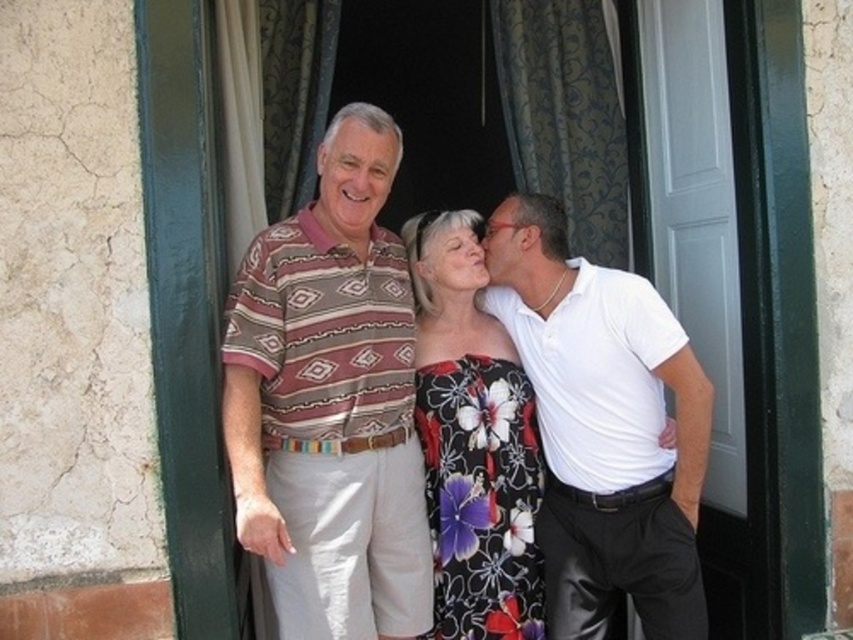
Is floral dress at center taller than blue patterned curtain at upper center?

Indeed, floral dress at center has a greater height compared to blue patterned curtain at upper center.

Who is more distant from viewer, (x=463, y=429) or (x=613, y=212)?

Point (x=613, y=212)

Identify the location of floral dress at center. (473, 440).

Is striped cotton shirt at center taller than white glossy shirt at right?

In fact, striped cotton shirt at center may be shorter than white glossy shirt at right.

Is point (347, 436) positioned in front of point (546, 372)?

Yes, it is.

Is point (227, 317) positioned after point (541, 195)?

No.

Identify the location of striped cotton shirt at center. (323, 436).

Does brown striped polo shirt at center appear on the right side of floral dress at center?

Incorrect, brown striped polo shirt at center is not on the right side of floral dress at center.

Does point (289, 330) lie behind point (473, 579)?

No, (289, 330) is in front of (473, 579).

Looking at this image, who is more forward, (289, 291) or (438, 364)?

Positioned in front is point (289, 291).

You are a GUI agent. You are given a task and a screenshot of the screen. Output one action in this format:
    pyautogui.click(x=<x>, y=<y>)
    Task: Click on the brown striped polo shirt at center
    Image resolution: width=853 pixels, height=640 pixels.
    Given the screenshot: What is the action you would take?
    pyautogui.click(x=329, y=408)